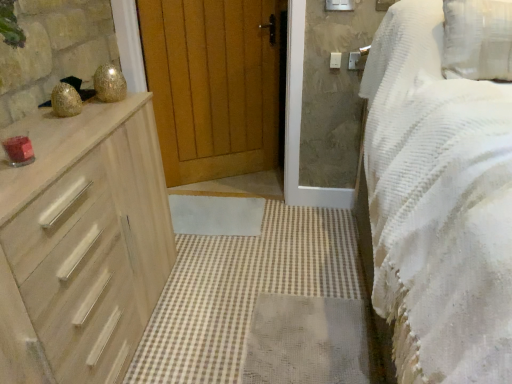
Identify the location of light wood chest of drawers at left. (86, 238).

The height and width of the screenshot is (384, 512). Describe the element at coordinates (216, 84) in the screenshot. I see `wooden at center` at that location.

This screenshot has height=384, width=512. What are the coordinates of `wooden at center` in the screenshot? It's located at (216, 84).

Identify the location of light wood chest of drawers at left. (86, 238).

Looking at this image, how many degrees apart are the facing directions of white plastic light switch at upper right and light wood chest of drawers at left?

white plastic light switch at upper right and light wood chest of drawers at left are facing 94.9 degrees away from each other.

You are a GUI agent. You are given a task and a screenshot of the screen. Output one action in this format:
    pyautogui.click(x=<x>, y=<y>)
    Task: Click on the light switch above the light wood chest of drawers at left (from the image's perspective)
    The width and height of the screenshot is (512, 384).
    Given the screenshot: What is the action you would take?
    pyautogui.click(x=335, y=60)

How much distance is there between white plastic light switch at upper right and light wood chest of drawers at left?

white plastic light switch at upper right is 4.69 feet away from light wood chest of drawers at left.

In the image, is white plastic light switch at upper right on the left side or the right side of light wood chest of drawers at left?

In the image, white plastic light switch at upper right appears on the right side of light wood chest of drawers at left.

Between wooden drawers at left and white textured bed at right, which one has less height?

wooden drawers at left.

Between point (288, 239) and point (496, 220), which one is positioned behind?

The point (288, 239) is behind.

Are wooden drawers at left and white textured bed at right beside each other?

wooden drawers at left and white textured bed at right are not in contact.

Is light wood chest of drawers at left with white plastic light switch at upper right?

No, light wood chest of drawers at left is not beside white plastic light switch at upper right.

Based on the photo, can you confirm if light wood chest of drawers at left is taller than white plastic light switch at upper right?

Yes, light wood chest of drawers at left is taller than white plastic light switch at upper right.

Looking at this image, can you confirm if light wood chest of drawers at left is positioned to the right of white plastic light switch at upper right?

Incorrect, light wood chest of drawers at left is not on the right side of white plastic light switch at upper right.

Is wooden drawers at left positioned with its back to white plastic light switch at upper right?

No, wooden drawers at left's orientation is not away from white plastic light switch at upper right.

In terms of height, does wooden drawers at left look taller or shorter compared to white plastic light switch at upper right?

wooden drawers at left is shorter than white plastic light switch at upper right.

Looking at this image, considering the positions of objects wooden drawers at left and white plastic light switch at upper right in the image provided, who is more to the left, wooden drawers at left or white plastic light switch at upper right?

Positioned to the left is wooden drawers at left.

Choose the correct answer: Is wooden drawers at left inside white plastic light switch at upper right or outside it?

wooden drawers at left is spatially situated outside white plastic light switch at upper right.

Does point (490, 184) lie behind point (104, 180)?

No, it is not.

Is the position of white textured bed at right more distant than that of light wood chest of drawers at left?

No, white textured bed at right is closer to the viewer.

Between white textured bed at right and light wood chest of drawers at left, which one has less height?

light wood chest of drawers at left.

Locate an element on the screen. Image resolution: width=512 pixels, height=384 pixels. chest of drawers located on the left of white textured bed at right is located at coordinates (86, 238).

From a real-world perspective, is wooden drawers at left under wooden at center?

Correct, in the physical world, wooden drawers at left is lower than wooden at center.

Is wooden drawers at left directly adjacent to wooden at center?

No, wooden drawers at left is not with wooden at center.

This screenshot has height=384, width=512. In the image, there is a wooden at center. Find the location of `plain below it (from a real-world perspective)`. plain below it (from a real-world perspective) is located at coordinates (x=262, y=306).

From the image's perspective, which is below, wooden drawers at left or wooden at center?

From the image's view, wooden drawers at left is below.

Considering the sizes of objects wooden at center and wooden drawers at left in the image provided, who is taller, wooden at center or wooden drawers at left?

With more height is wooden at center.

Does wooden at center have a lesser width compared to wooden drawers at left?

Yes.

In terms of size, does wooden at center appear bigger or smaller than wooden drawers at left?

In the image, wooden at center appears to be larger than wooden drawers at left.

Could you tell me if wooden at center is turned towards wooden drawers at left?

Yes.

At what (x,y) coordinates should I click in order to perform the action: click on the chest of drawers lying below the white plastic light switch at upper right (from the image's perspective). Please return your answer as a coordinate pair (x, y). The height and width of the screenshot is (384, 512). Looking at the image, I should click on (86, 238).

The height and width of the screenshot is (384, 512). I want to click on bed that is above the wooden drawers at left (from the image's perspective), so click(x=438, y=204).

Estimate the real-world distances between objects in this image. Which object is further from wooden at center, white textured bed at right or wooden drawers at left?

Based on the image, white textured bed at right appears to be further to wooden at center.

Based on their spatial positions, is wooden drawers at left or light wood chest of drawers at left further from white textured bed at right?

Among the two, light wood chest of drawers at left is located further to white textured bed at right.

Based on the photo, considering their positions, is light wood chest of drawers at left positioned further to wooden at center than wooden drawers at left?

Among the two, light wood chest of drawers at left is located further to wooden at center.

Which object lies further to the anchor point light wood chest of drawers at left, white textured bed at right or wooden drawers at left?

white textured bed at right is positioned further to the anchor light wood chest of drawers at left.

Which object lies nearer to the anchor point white textured bed at right, white plastic light switch at upper right or wooden drawers at left?

wooden drawers at left.

Looking at the image, which one is located closer to white plastic light switch at upper right, light wood chest of drawers at left or wooden at center?

wooden at center is positioned closer to the anchor white plastic light switch at upper right.

Estimate the real-world distances between objects in this image. Which object is further from white textured bed at right, white plastic light switch at upper right or light wood chest of drawers at left?

Among the two, white plastic light switch at upper right is located further to white textured bed at right.

Looking at the image, which one is located further to white plastic light switch at upper right, wooden drawers at left or wooden at center?

Among the two, wooden drawers at left is located further to white plastic light switch at upper right.

Image resolution: width=512 pixels, height=384 pixels. In order to click on plain located between light wood chest of drawers at left and white plastic light switch at upper right in the depth direction in this screenshot , I will do `click(262, 306)`.

In order to click on door positioned between light wood chest of drawers at left and white plastic light switch at upper right from near to far in this screenshot , I will do `click(216, 84)`.

This screenshot has width=512, height=384. Find the location of `plain located between white textured bed at right and wooden at center in the depth direction`. plain located between white textured bed at right and wooden at center in the depth direction is located at coordinates (262, 306).

Where is `the chest of drawers located between white textured bed at right and wooden at center in the depth direction`? This screenshot has width=512, height=384. the chest of drawers located between white textured bed at right and wooden at center in the depth direction is located at coordinates pyautogui.click(x=86, y=238).